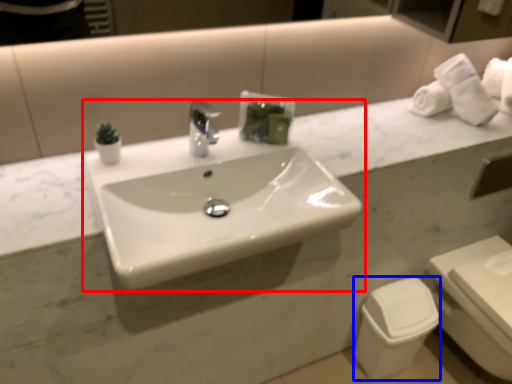
Question: Among these objects, which one is farthest to the camera, sink (highlighted by a red box) or toilet bowl (highlighted by a blue box)?

Choices:
 (A) sink
 (B) toilet bowl

Answer: (B)